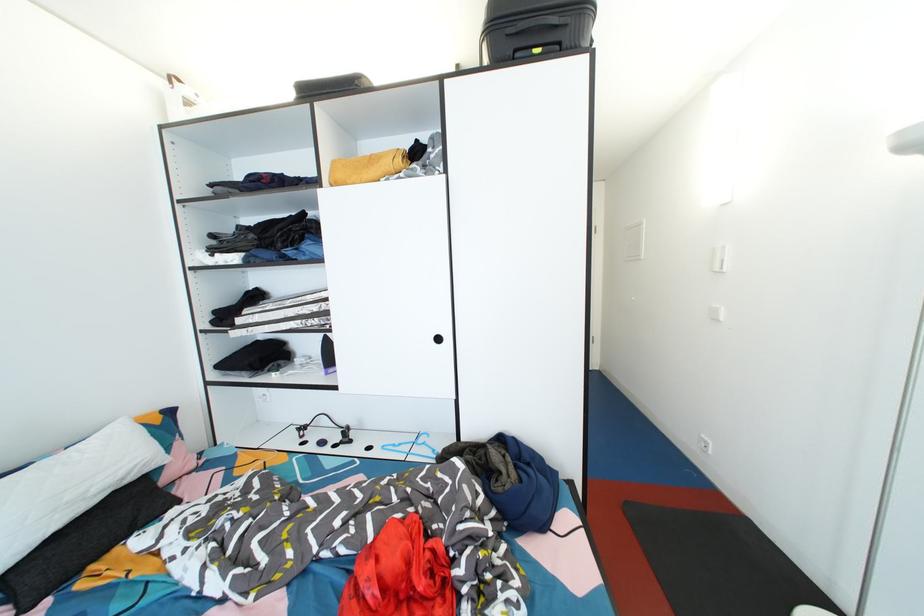
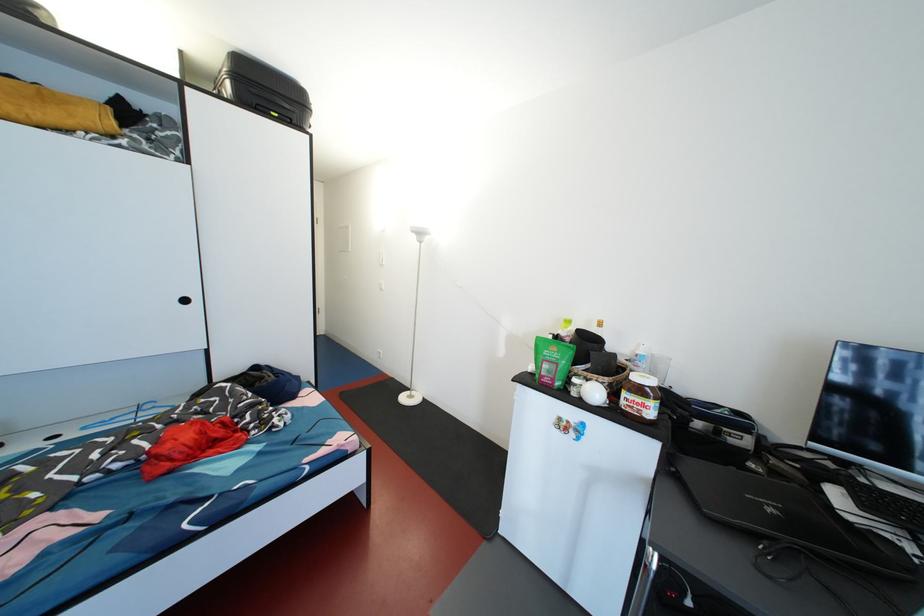
Locate, in the second image, the point that corresponds to pixel 545 55 in the first image.

(283, 120)